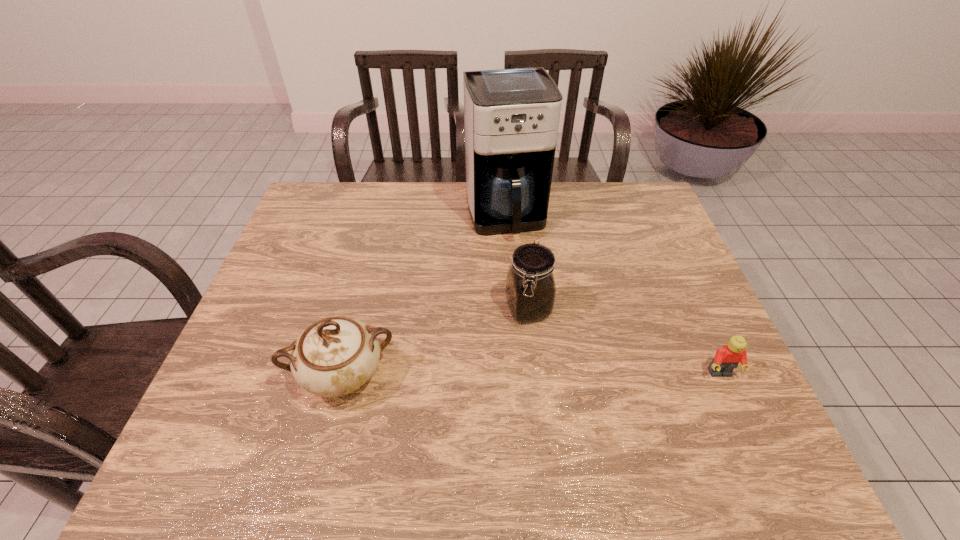
Identify the location of vacant space at the near edge. (322, 398).

This screenshot has width=960, height=540. Identify the location of vacant space at the left edge of the desktop. (278, 374).

This screenshot has height=540, width=960. I want to click on vacant space at the right edge, so click(670, 252).

In the image, there is a desktop. Where is `vacant space at the far left corner`? vacant space at the far left corner is located at coordinates (342, 194).

You are a GUI agent. You are given a task and a screenshot of the screen. Output one action in this format:
    pyautogui.click(x=<x>, y=<y>)
    Task: Click on the free space at the far right corner of the desktop
    This screenshot has width=960, height=540.
    Given the screenshot: What is the action you would take?
    (648, 212)

This screenshot has height=540, width=960. I want to click on vacant point located between the rightmost object and the jar, so click(x=624, y=342).

The width and height of the screenshot is (960, 540). What are the coordinates of `free spot between the coffee maker and the Lego` in the screenshot? It's located at (612, 295).

Image resolution: width=960 pixels, height=540 pixels. I want to click on free space between the second farthest object and the shortest object, so click(624, 342).

Where is `empty space between the third nearest object and the Lego`? The height and width of the screenshot is (540, 960). empty space between the third nearest object and the Lego is located at coordinates (624, 342).

Locate an element on the screen. The image size is (960, 540). free space between the chinaware and the rightmost object is located at coordinates (532, 375).